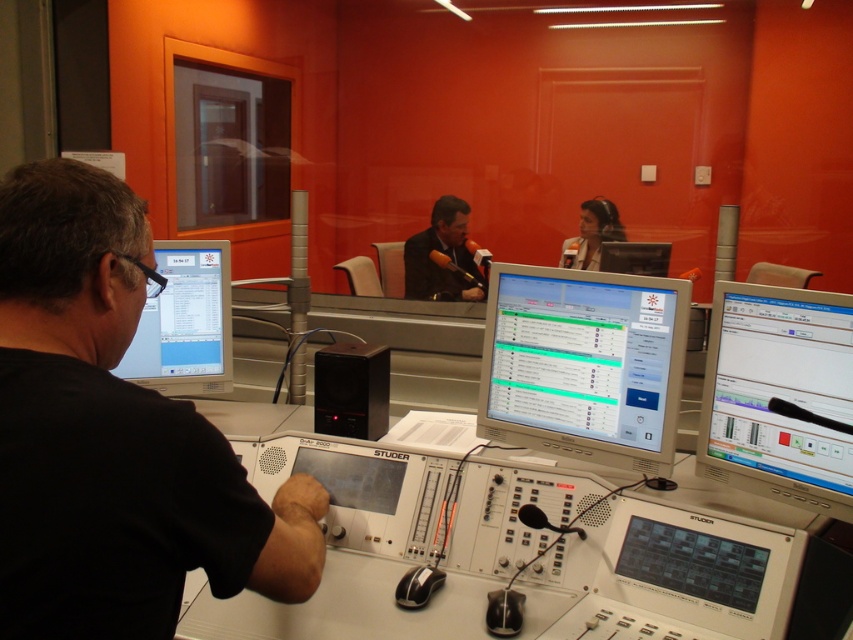
You are designing a layout for a control panel that needs to fit both the matte black monitor at left and the dark suit at center. Since space is limited, which object requires more horizontal space and should be placed first?

The dark suit at center requires more horizontal space because it is wider than the matte black monitor at left, so it should be placed first to ensure adequate room.

You are standing in the radio studio and want to know which of the two points, point (204,296) or point (407,248), is closer to you. Based on the studio layout, which point is nearer?

Point (204,296) is closer to the camera than point (407,248), so it is nearer to you.